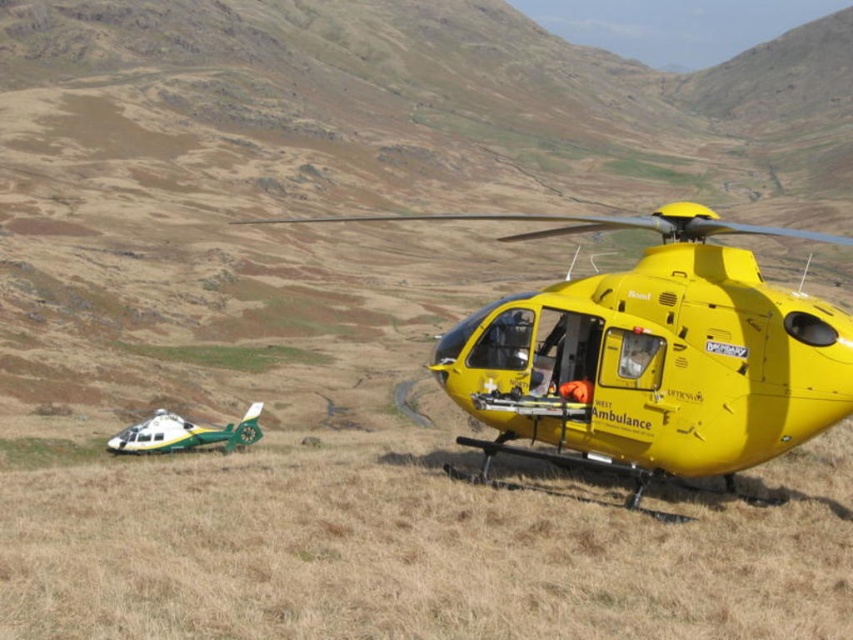
You are a pilot planning to land a third helicopter between the yellow matte helicopter at center and the green matte helicopter at lower left. Based on their sizes, is there enough space between them for your helicopter?

The yellow matte helicopter at center might be wider than green matte helicopter at lower left, so there may not be enough space between them for your helicopter.

You are a pilot planning to land a helicopter in this mountainous area. You see the yellow matte helicopter at center and the green grassy field at lower left. Which location would you choose for landing, and why?

The green grassy field at lower left is a better landing spot because the yellow matte helicopter at center is already occupying that area, and the field is to the left of it. However, the description mentions the field is at lower left, so if the helicopter is at center and to the right of the field, the field might be a suitable alternative if clear of obstacles.

You are a pilot planning to land a new helicopter that is 2 meters wide. You see the yellow matte helicopter at center and the green grassy field at lower left. Which area can accommodate your helicopter?

The yellow matte helicopter at center might be wider than green grassy field at lower left, so the yellow matte helicopter at center area is more likely to accommodate your 2 meter wide helicopter.